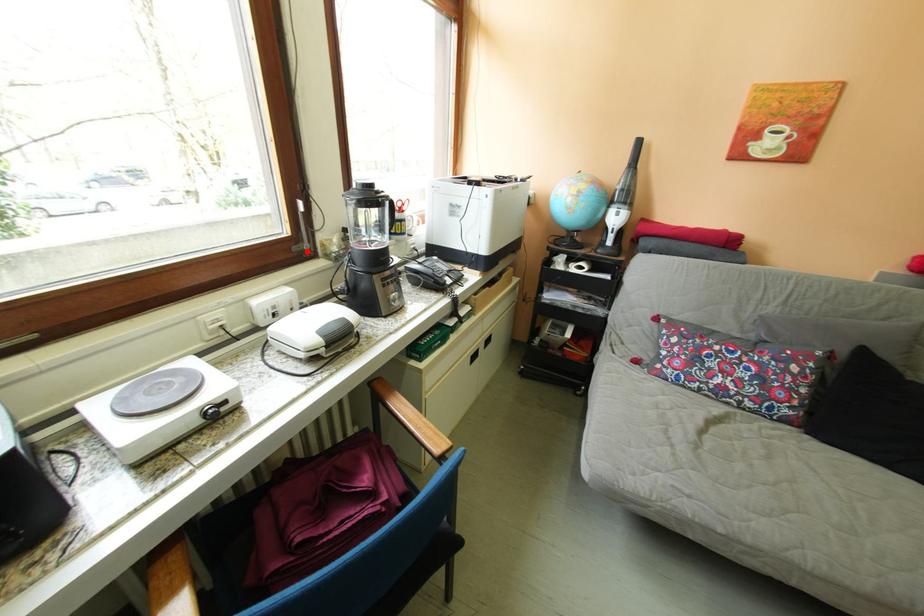
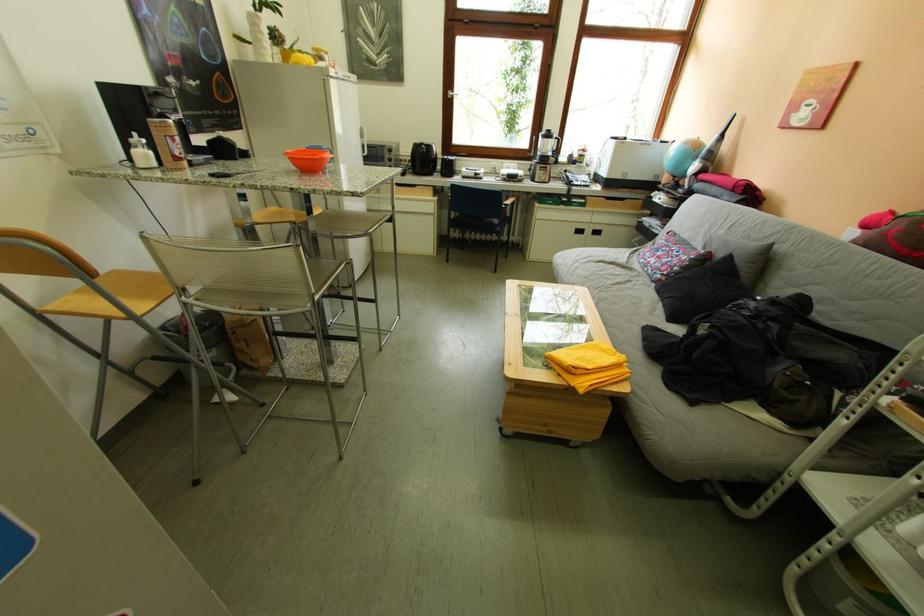
In the second image, find the point that corresponds to the highlighted location in the first image.

(541, 156)